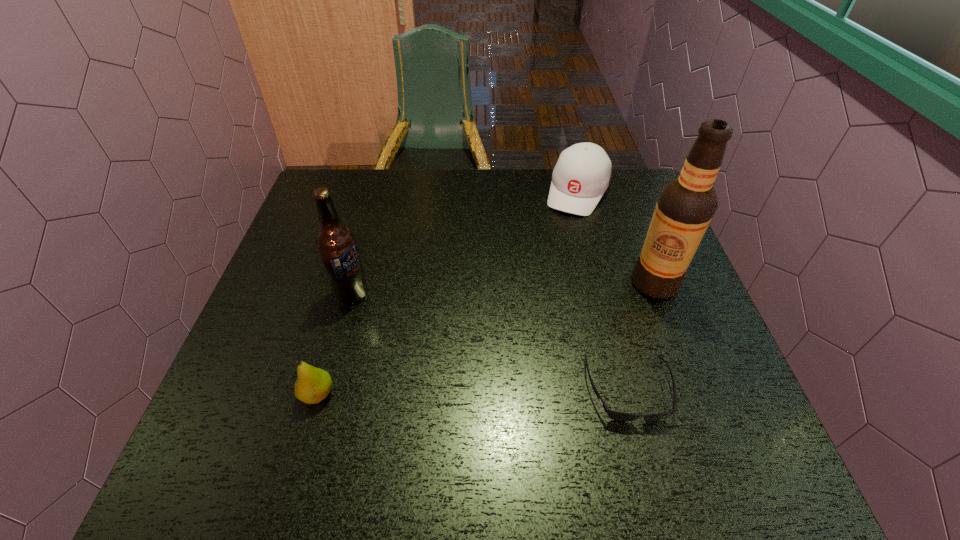
Identify the location of the fourth closest object to the pear. This screenshot has width=960, height=540. (582, 174).

Point out which object is positioned as the third nearest to the farthest object. Please provide its 2D coordinates. Your answer should be formatted as a tuple, i.e. [(x, y)], where the tuple contains the x and y coordinates of a point satisfying the conditions above.

[(336, 243)]

Locate an element on the screen. free region that satisfies the following two spatial constraints: 1. on the back side of the pear; 2. on the right side of the farthest object is located at coordinates (x=375, y=192).